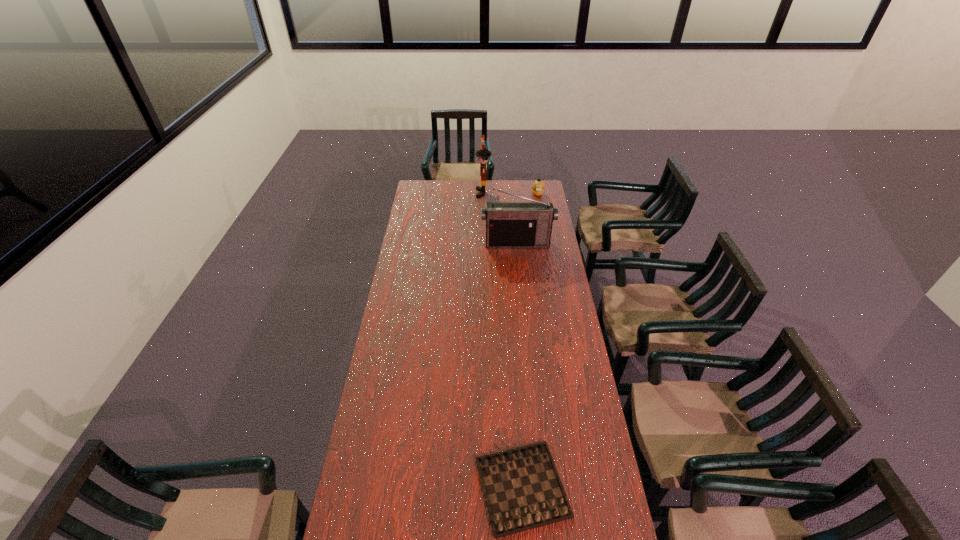
Identify the location of vacant area located on the left of the chessboard. The width and height of the screenshot is (960, 540). (398, 487).

At what (x,y) coordinates should I click in order to perform the action: click on nutcracker located at the far edge. Please return your answer as a coordinate pair (x, y). Image resolution: width=960 pixels, height=540 pixels. Looking at the image, I should click on (482, 154).

This screenshot has height=540, width=960. Find the location of `duckling located at the far edge`. duckling located at the far edge is located at coordinates (538, 186).

Where is `radio receiver that is at the right edge`? The width and height of the screenshot is (960, 540). radio receiver that is at the right edge is located at coordinates (508, 224).

Locate an element on the screen. duckling that is at the right edge is located at coordinates (538, 186).

Locate an element on the screen. This screenshot has height=540, width=960. chessboard that is at the right edge is located at coordinates (522, 488).

Where is `object that is at the far right corner`? The image size is (960, 540). object that is at the far right corner is located at coordinates (538, 186).

Identify the location of free space at the far edge of the desktop. This screenshot has height=540, width=960. pyautogui.click(x=493, y=181).

In the image, there is a desktop. Where is `free space at the left edge`? free space at the left edge is located at coordinates (412, 211).

The image size is (960, 540). I want to click on vacant space at the right edge, so click(573, 443).